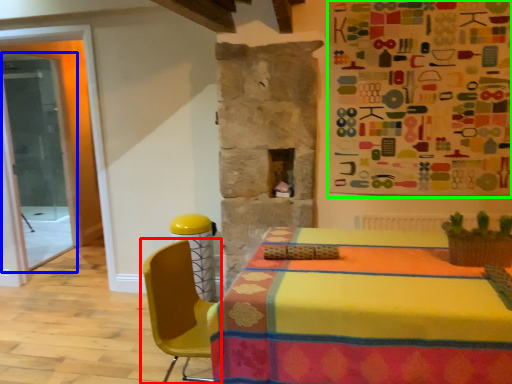
Question: Estimate the real-world distances between objects in this image. Which object is closer to chair (highlighted by a red box), glass door (highlighted by a blue box) or bulletin board (highlighted by a green box)?

Choices:
 (A) glass door
 (B) bulletin board

Answer: (B)